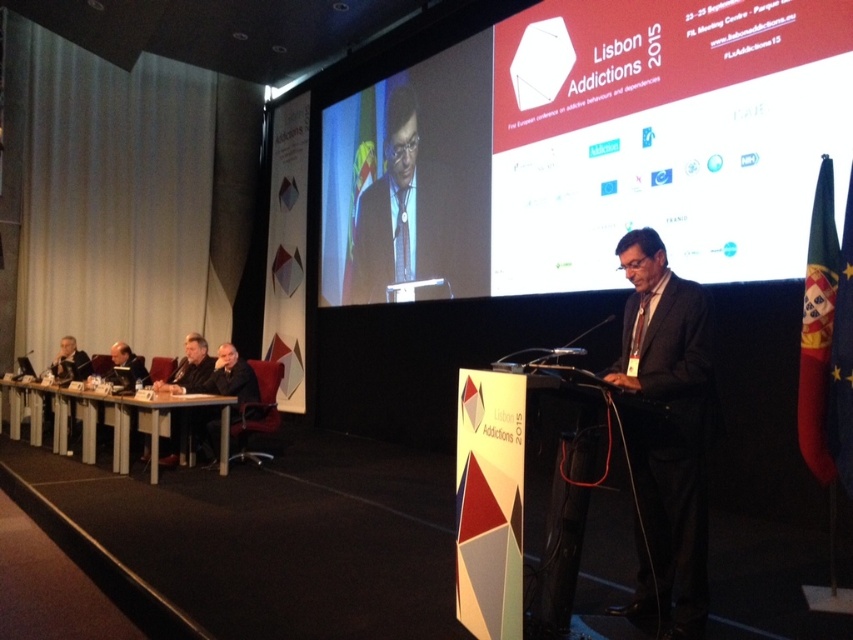
Based on the scene description, can you determine the spatial relationship between the white plastic table at lower left and the dark brown leather jacket at center?

The white plastic table at lower left is positioned to the left of the dark brown leather jacket at center.

You are an event organizer who needs to place a laptop on the surface of the white plastic table at lower left and hang the dark brown leather jacket at center on a coat rack. Can you do both tasks without moving either object from their current positions?

The white plastic table at lower left is not as tall as the dark brown leather jacket at center, so the laptop can be placed on the table, and the jacket can be hung on the coat rack without moving either object.

You are organizing a small workshop and need to place a laptop and some documents on the white plastic table at lower left and the dark brown leather jacket at center. Which surface will accommodate both items more comfortably?

The white plastic table at lower left has a larger width than the dark brown leather jacket at center, so it can comfortably hold both the laptop and documents.